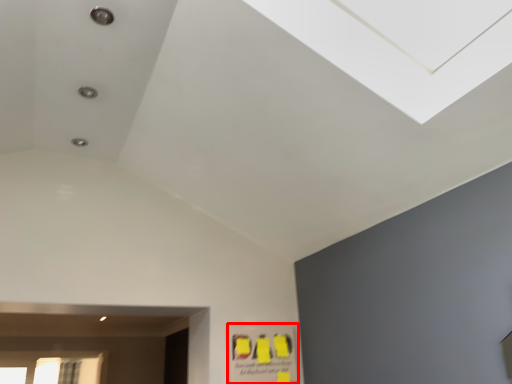
Question: From the image's perspective, where is poster (annotated by the red box) located relative to window?

Choices:
 (A) below
 (B) above

Answer: (B)